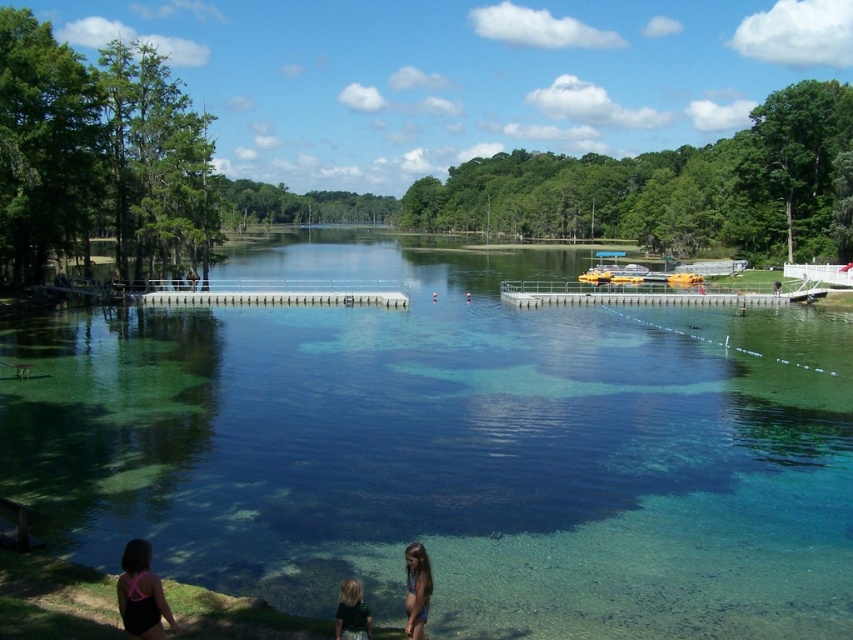
Does yellow metallic dock at center have a lesser height compared to light brown hair at lower center?

No.

Find the location of `yellow metallic dock at center`. yellow metallic dock at center is located at coordinates (641, 294).

Based on the photo, between clear glass water at center and pink swimsuit at lower left, which one is positioned higher?

clear glass water at center is higher up.

Who is lower down, clear glass water at center or pink swimsuit at lower left?

Positioned lower is pink swimsuit at lower left.

Describe the element at coordinates (451, 449) in the screenshot. I see `clear glass water at center` at that location.

Locate an element on the screen. This screenshot has width=853, height=640. clear glass water at center is located at coordinates (451, 449).

Describe the element at coordinates (141, 595) in the screenshot. I see `pink swimsuit at lower left` at that location.

Is point (131, 596) positioned after point (361, 616)?

No, it is in front of (361, 616).

The width and height of the screenshot is (853, 640). In order to click on pink swimsuit at lower left in this screenshot , I will do `click(141, 595)`.